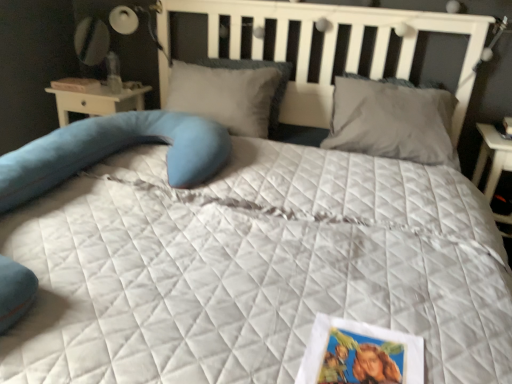
Question: Considering the relative sizes of soft gray pillow at center, placed as the 2th pillow when sorted from right to left, and white paper book at upper left in the image provided, is soft gray pillow at center, placed as the 2th pillow when sorted from right to left, wider than white paper book at upper left?

Choices:
 (A) yes
 (B) no

Answer: (A)

Question: Is soft gray pillow at center, placed as the 2th pillow when sorted from right to left, facing away from white paper book at upper left?

Choices:
 (A) yes
 (B) no

Answer: (B)

Question: Is soft gray pillow at center, the first pillow from the left, bigger than white paper book at upper left?

Choices:
 (A) no
 (B) yes

Answer: (B)

Question: Is soft gray pillow at center, placed as the 2th pillow when sorted from right to left, not within white paper book at upper left?

Choices:
 (A) no
 (B) yes

Answer: (B)

Question: Considering the relative positions of soft gray pillow at center, placed as the 2th pillow when sorted from right to left, and white paper book at upper left in the image provided, is soft gray pillow at center, placed as the 2th pillow when sorted from right to left, to the left of white paper book at upper left from the viewer's perspective?

Choices:
 (A) yes
 (B) no

Answer: (B)

Question: Is white paper book at upper left inside or outside of printed paper postcard at lower right?

Choices:
 (A) inside
 (B) outside

Answer: (B)

Question: Is white paper book at upper left wider or thinner than printed paper postcard at lower right?

Choices:
 (A) thin
 (B) wide

Answer: (A)

Question: From the image's perspective, relative to printed paper postcard at lower right, is white paper book at upper left above or below?

Choices:
 (A) above
 (B) below

Answer: (A)

Question: Considering the positions of white paper book at upper left and printed paper postcard at lower right in the image, is white paper book at upper left taller or shorter than printed paper postcard at lower right?

Choices:
 (A) tall
 (B) short

Answer: (A)

Question: Considering the positions of soft gray pillow at center, placed as the 2th pillow when sorted from right to left, and printed paper postcard at lower right in the image, is soft gray pillow at center, placed as the 2th pillow when sorted from right to left, wider or thinner than printed paper postcard at lower right?

Choices:
 (A) wide
 (B) thin

Answer: (A)

Question: Is soft gray pillow at center, placed as the 2th pillow when sorted from right to left, in front of or behind printed paper postcard at lower right in the image?

Choices:
 (A) front
 (B) behind

Answer: (B)

Question: From the image's perspective, relative to printed paper postcard at lower right, is soft gray pillow at center, the first pillow from the left, above or below?

Choices:
 (A) below
 (B) above

Answer: (B)

Question: From a real-world perspective, is soft gray pillow at center, the first pillow from the left, above or below printed paper postcard at lower right?

Choices:
 (A) below
 (B) above

Answer: (B)

Question: From a real-world perspective, relative to printed paper postcard at lower right, is gray matte pillow at upper right, the first pillow positioned from the right, vertically above or below?

Choices:
 (A) above
 (B) below

Answer: (A)

Question: Is gray matte pillow at upper right, placed as the second pillow when sorted from left to right, wider or thinner than printed paper postcard at lower right?

Choices:
 (A) wide
 (B) thin

Answer: (A)